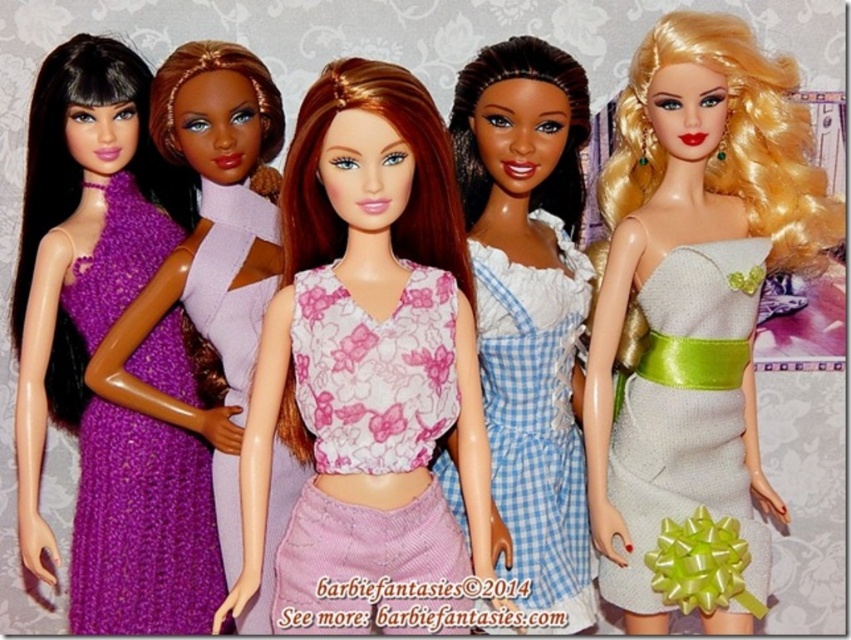
Is floral fabric top at center to the right of purple knitted dress at center from the viewer's perspective?

Yes, floral fabric top at center is to the right of purple knitted dress at center.

This screenshot has width=851, height=640. Describe the element at coordinates (369, 444) in the screenshot. I see `floral fabric top at center` at that location.

Who is more forward, (333, 628) or (288, 513)?

Point (333, 628) is in front.

At what (x,y) coordinates should I click in order to perform the action: click on floral fabric top at center. Please return your answer as a coordinate pair (x, y). The image size is (851, 640). Looking at the image, I should click on (369, 444).

Consider the image. Is the position of shiny silver dress at right more distant than that of silver sequined dress at center?

No, it is in front of silver sequined dress at center.

Is shiny silver dress at right positioned in front of silver sequined dress at center?

Yes, shiny silver dress at right is closer to the viewer.

Which is behind, point (655, 342) or point (752, 582)?

The point (655, 342) is more distant.

The height and width of the screenshot is (640, 851). Find the location of `shiny silver dress at right`. shiny silver dress at right is located at coordinates (694, 291).

Which is behind, point (680, 90) or point (78, 154)?

Point (78, 154)

At what (x,y) coordinates should I click in order to perform the action: click on shiny silver dress at right. Please return your answer as a coordinate pair (x, y). This screenshot has height=640, width=851. Looking at the image, I should click on (694, 291).

Find the location of a particular element. This screenshot has width=851, height=640. shiny silver dress at right is located at coordinates (694, 291).